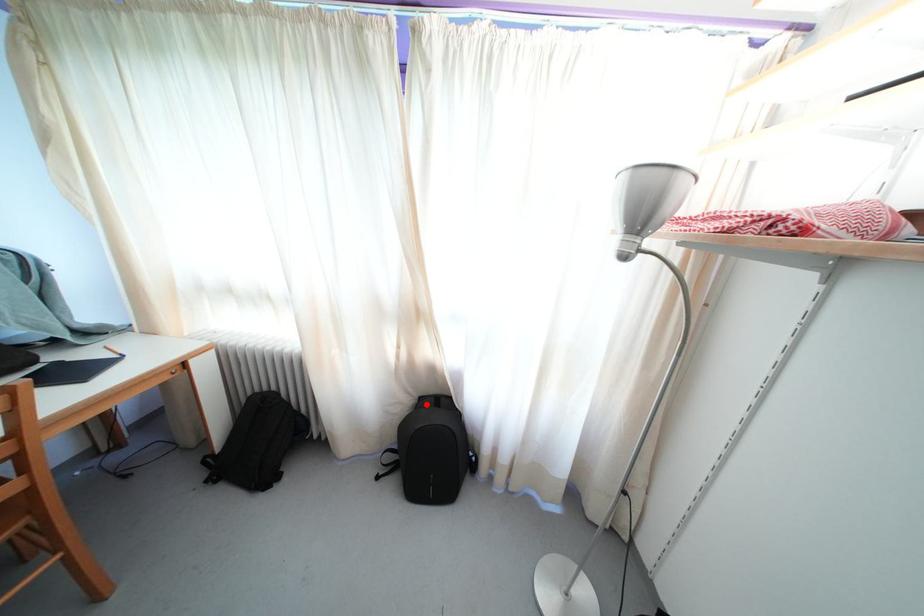
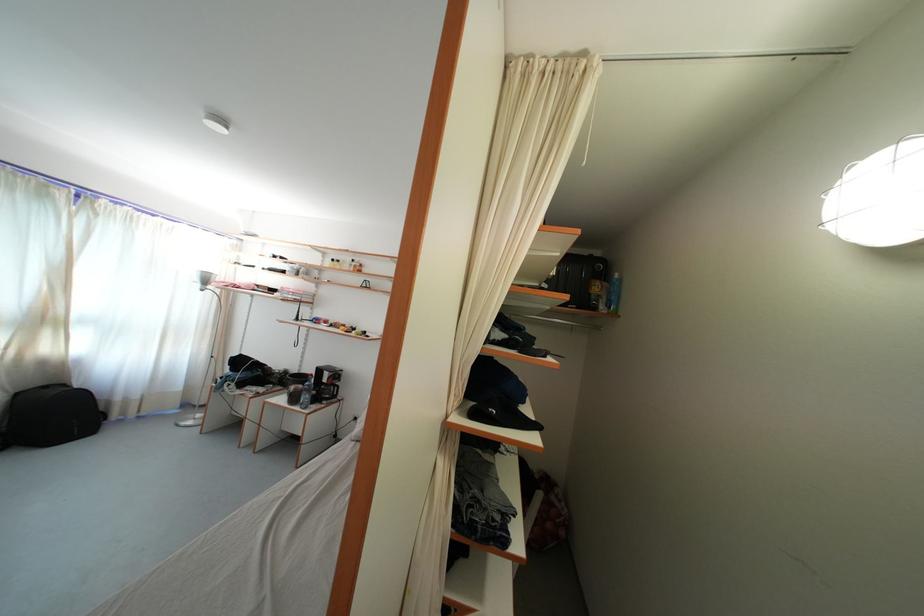
In the second image, find the point that corresponds to the highlighted location in the first image.

(23, 400)